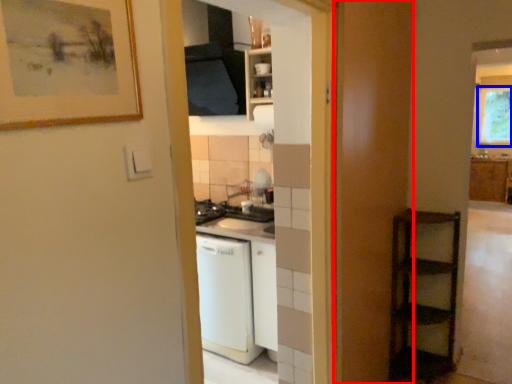
Question: Among these objects, which one is farthest to the camera, screen door (highlighted by a red box) or window (highlighted by a blue box)?

Choices:
 (A) screen door
 (B) window

Answer: (B)